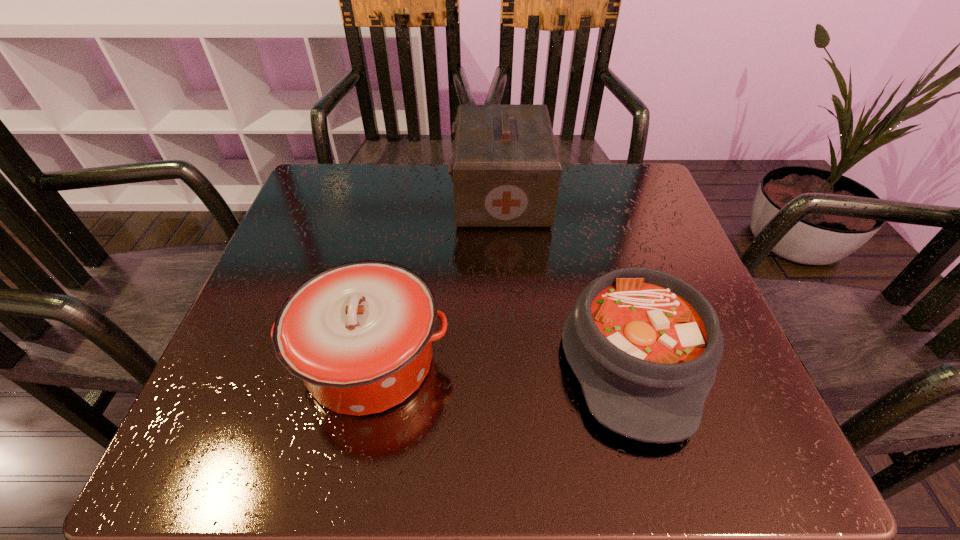
Where is `free space between the shorter casserole and the taller casserole`? The image size is (960, 540). free space between the shorter casserole and the taller casserole is located at coordinates (502, 358).

The width and height of the screenshot is (960, 540). I want to click on vacant space that is in between the right casserole and the taller casserole, so click(502, 358).

The image size is (960, 540). What are the coordinates of `vacant area that lies between the shortest object and the left casserole` in the screenshot? It's located at (502, 358).

Identify the location of empty space between the taller casserole and the shorter casserole. Image resolution: width=960 pixels, height=540 pixels. (502, 358).

This screenshot has width=960, height=540. Find the location of `free space between the shorter casserole and the tallest object`. free space between the shorter casserole and the tallest object is located at coordinates (567, 274).

I want to click on free area in between the first-aid kit and the shorter casserole, so click(x=567, y=274).

Locate an element on the screen. The image size is (960, 540). vacant point located between the tallest object and the left casserole is located at coordinates (436, 278).

Locate an element on the screen. This screenshot has height=540, width=960. free space between the taller casserole and the right casserole is located at coordinates (502, 358).

Locate an element on the screen. free spot between the farthest object and the shorter casserole is located at coordinates (567, 274).

Where is `free spot between the shortest object and the taller casserole`? Image resolution: width=960 pixels, height=540 pixels. free spot between the shortest object and the taller casserole is located at coordinates (502, 358).